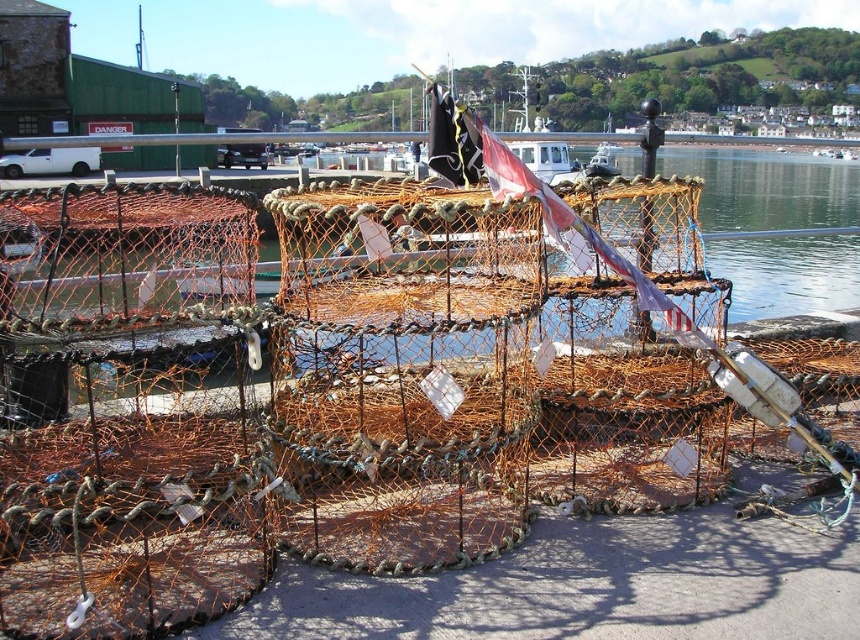
Is rustic wire mesh crab pot at center taller than white plastic boat at center?

Incorrect, rustic wire mesh crab pot at center's height is not larger of white plastic boat at center's.

Is rustic wire mesh crab pot at center wider than white plastic boat at center?

In fact, rustic wire mesh crab pot at center might be narrower than white plastic boat at center.

The width and height of the screenshot is (860, 640). What do you see at coordinates (402, 372) in the screenshot?
I see `rustic wire mesh crab pot at center` at bounding box center [402, 372].

Where is `rustic wire mesh crab pot at center`? The image size is (860, 640). rustic wire mesh crab pot at center is located at coordinates pyautogui.click(x=402, y=372).

Between orange mesh netting at center and white plastic boat at center, which one appears on the left side from the viewer's perspective?

orange mesh netting at center

Between orange mesh netting at center and white plastic boat at center, which one appears on the right side from the viewer's perspective?

white plastic boat at center is more to the right.

This screenshot has height=640, width=860. What are the coordinates of `orange mesh netting at center` in the screenshot? It's located at (775, 225).

Can you confirm if rustic wire mesh crab pot at center is thinner than orange mesh netting at center?

Indeed, rustic wire mesh crab pot at center has a lesser width compared to orange mesh netting at center.

Is rustic wire mesh crab pot at center to the left of orange mesh netting at center from the viewer's perspective?

Correct, you'll find rustic wire mesh crab pot at center to the left of orange mesh netting at center.

Which is behind, point (407, 196) or point (774, 218)?

Positioned behind is point (774, 218).

The height and width of the screenshot is (640, 860). I want to click on rustic wire mesh crab pot at center, so click(x=402, y=372).